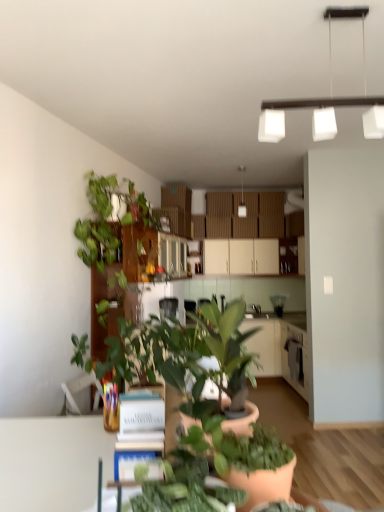
Locate an element on the screen. green leafy plant at left, placed as the third houseplant when sorted from front to back is located at coordinates (108, 218).

What do you see at coordinates (108, 218) in the screenshot? This screenshot has width=384, height=512. I see `green leafy plant at left, placed as the first houseplant when sorted from left to right` at bounding box center [108, 218].

At what (x,y) coordinates should I click in order to perform the action: click on green matte plant at center, arranged as the second houseplant when viewed from the back. Please return your answer as a coordinate pair (x, y). Image resolution: width=384 pixels, height=512 pixels. Looking at the image, I should click on (222, 361).

What is the approximate width of green matte plant at center, which ranks as the second houseplant in left-to-right order?

The width of green matte plant at center, which ranks as the second houseplant in left-to-right order, is 12.36 inches.

This screenshot has height=512, width=384. What do you see at coordinates (241, 257) in the screenshot?
I see `white matte cabinet at center` at bounding box center [241, 257].

Measure the distance between point (275, 490) and camera.

The depth of point (275, 490) is 32.52 inches.

Locate an element on the screen. green leafy plant at left, which ranks as the 1th houseplant in back-to-front order is located at coordinates (108, 218).

Considering the positions of objects green matte plant at center, positioned as the 3th houseplant in left-to-right order, and white matte cabinet at center in the image provided, who is more to the left, green matte plant at center, positioned as the 3th houseplant in left-to-right order, or white matte cabinet at center?

green matte plant at center, positioned as the 3th houseplant in left-to-right order, is more to the left.

Is white matte cabinet at center located within green matte plant at center, which is the 1th houseplant from right to left?

Actually, white matte cabinet at center is outside green matte plant at center, which is the 1th houseplant from right to left.

Measure the distance between green matte plant at center, which is the 1th houseplant from right to left, and white matte cabinet at center.

green matte plant at center, which is the 1th houseplant from right to left, and white matte cabinet at center are 4.70 meters apart from each other.

Which object is further away from the camera, green matte plant at center, which is counted as the 1th houseplant, starting from the front, or green matte plant at center, the second houseplant viewed from the right?

green matte plant at center, the second houseplant viewed from the right, is behind.

Could you measure the distance between green matte plant at center, which is the 1th houseplant from right to left, and green matte plant at center, which ranks as the second houseplant in left-to-right order?

green matte plant at center, which is the 1th houseplant from right to left, is 25.35 centimeters away from green matte plant at center, which ranks as the second houseplant in left-to-right order.

From the picture: Is green matte plant at center, the 3th houseplant when ordered from back to front, shorter than green matte plant at center, arranged as the second houseplant when viewed from the back?

Yes.

Are green matte plant at center, which is counted as the 1th houseplant, starting from the front, and green matte plant at center, the second houseplant viewed from the right, located far from each other?

No, there isn't a large distance between green matte plant at center, which is counted as the 1th houseplant, starting from the front, and green matte plant at center, the second houseplant viewed from the right.

Identify the location of cabinetry that appears behind the green matte plant at center, which is counted as the 1th houseplant, starting from the front. This screenshot has height=512, width=384. (241, 257).

From a real-world perspective, relative to green matte plant at center, positioned as the 3th houseplant in left-to-right order, is white matte cabinet at center vertically above or below?

white matte cabinet at center is above green matte plant at center, positioned as the 3th houseplant in left-to-right order.

Is white matte cabinet at center in front of green matte plant at center, which is the 1th houseplant from right to left?

No, it is not.

Is point (278, 243) closer or farther from the camera than point (259, 488)?

Point (278, 243) is positioned farther from the camera compared to point (259, 488).

What's the angular difference between green matte plant at center, arranged as the second houseplant when viewed from the back, and green leafy plant at left, which ranks as the 1th houseplant in back-to-front order,'s facing directions?

green matte plant at center, arranged as the second houseplant when viewed from the back, and green leafy plant at left, which ranks as the 1th houseplant in back-to-front order, are facing 14.8 degrees away from each other.

Looking at the image, does green matte plant at center, which ranks as the second houseplant in left-to-right order, seem bigger or smaller compared to green leafy plant at left, placed as the first houseplant when sorted from left to right?

green matte plant at center, which ranks as the second houseplant in left-to-right order, is smaller than green leafy plant at left, placed as the first houseplant when sorted from left to right.

From a real-world perspective, does green matte plant at center, arranged as the second houseplant when viewed from the back, stand above green leafy plant at left, which ranks as the 1th houseplant in back-to-front order?

No, from a real-world perspective, green matte plant at center, arranged as the second houseplant when viewed from the back, is not on top of green leafy plant at left, which ranks as the 1th houseplant in back-to-front order.

From the image's perspective, which one is positioned higher, green matte plant at center, the second houseplant viewed from the right, or green leafy plant at left, placed as the first houseplant when sorted from left to right?

green leafy plant at left, placed as the first houseplant when sorted from left to right.

Considering the relative sizes of green matte plant at center, which ranks as the second houseplant in left-to-right order, and white matte cabinet at center in the image provided, is green matte plant at center, which ranks as the second houseplant in left-to-right order, smaller than white matte cabinet at center?

Correct, green matte plant at center, which ranks as the second houseplant in left-to-right order, occupies less space than white matte cabinet at center.

Consider the image. From the image's perspective, between green matte plant at center, arranged as the second houseplant when viewed from the back, and white matte cabinet at center, who is located below?

From the image's view, green matte plant at center, arranged as the second houseplant when viewed from the back, is below.

From a real-world perspective, is green matte plant at center, the second houseplant viewed from the right, positioned under white matte cabinet at center based on gravity?

Indeed, from a real-world perspective, green matte plant at center, the second houseplant viewed from the right, is positioned beneath white matte cabinet at center.

Is the position of green matte plant at center, the second houseplant viewed from the right, less distant than that of white matte cabinet at center?

Yes, green matte plant at center, the second houseplant viewed from the right, is in front of white matte cabinet at center.

Is green matte plant at center, the 3th houseplant when ordered from back to front, not close to white matte book at center?

No, there isn't a large distance between green matte plant at center, the 3th houseplant when ordered from back to front, and white matte book at center.

Between green matte plant at center, positioned as the 3th houseplant in left-to-right order, and white matte book at center, which one has more height?

white matte book at center is taller.

Is green matte plant at center, the 3th houseplant when ordered from back to front, positioned with its back to white matte book at center?

green matte plant at center, the 3th houseplant when ordered from back to front, does not have its back to white matte book at center.

What's the angular difference between green leafy plant at left, which ranks as the 1th houseplant in back-to-front order, and green matte plant at center, the second houseplant viewed from the right,'s facing directions?

green leafy plant at left, which ranks as the 1th houseplant in back-to-front order, and green matte plant at center, the second houseplant viewed from the right, are facing 14.8 degrees away from each other.

Between point (91, 256) and point (199, 325), which one is positioned in front?

Positioned in front is point (199, 325).

Consider the image. Could you measure the distance between green leafy plant at left, placed as the first houseplant when sorted from left to right, and green matte plant at center, which is the 2th houseplant from front to back?

A distance of 1.88 meters exists between green leafy plant at left, placed as the first houseplant when sorted from left to right, and green matte plant at center, which is the 2th houseplant from front to back.

Are green leafy plant at left, which ranks as the 1th houseplant in back-to-front order, and green matte plant at center, arranged as the second houseplant when viewed from the back, located far from each other?

Absolutely, green leafy plant at left, which ranks as the 1th houseplant in back-to-front order, is distant from green matte plant at center, arranged as the second houseplant when viewed from the back.

The height and width of the screenshot is (512, 384). I want to click on cabinetry behind the green matte plant at center, positioned as the 3th houseplant in left-to-right order, so click(241, 257).

Image resolution: width=384 pixels, height=512 pixels. In order to click on houseplant below the green matte plant at center, the second houseplant viewed from the right (from a real-world perspective) in this screenshot , I will do `click(260, 466)`.

When comparing their distances from green leafy plant at left, which is the third houseplant from right to left, does green matte plant at center, which is the 1th houseplant from right to left, or white matte cabinet at center seem closer?

Among the two, white matte cabinet at center is located nearer to green leafy plant at left, which is the third houseplant from right to left.

Looking at this image, when comparing their distances from green matte plant at center, positioned as the 3th houseplant in left-to-right order, does green matte plant at center, which ranks as the second houseplant in left-to-right order, or white matte cabinet at center seem closer?

Among the two, green matte plant at center, which ranks as the second houseplant in left-to-right order, is located nearer to green matte plant at center, positioned as the 3th houseplant in left-to-right order.

Looking at the image, which one is located closer to white matte book at center, green matte plant at center, which ranks as the second houseplant in left-to-right order, or white matte cabinet at center?

green matte plant at center, which ranks as the second houseplant in left-to-right order, is closer to white matte book at center.

Which object lies further to the anchor point green leafy plant at left, which ranks as the 1th houseplant in back-to-front order, white matte cabinet at center or green matte plant at center, which is counted as the 1th houseplant, starting from the front?

Based on the image, green matte plant at center, which is counted as the 1th houseplant, starting from the front, appears to be further to green leafy plant at left, which ranks as the 1th houseplant in back-to-front order.

Estimate the real-world distances between objects in this image. Which object is closer to white matte cabinet at center, green leafy plant at left, placed as the third houseplant when sorted from front to back, or green matte plant at center, which ranks as the second houseplant in left-to-right order?

green leafy plant at left, placed as the third houseplant when sorted from front to back, is positioned closer to the anchor white matte cabinet at center.

Based on their spatial positions, is white matte cabinet at center or green matte plant at center, which is the 2th houseplant from front to back, further from green leafy plant at left, placed as the third houseplant when sorted from front to back?

white matte cabinet at center is further to green leafy plant at left, placed as the third houseplant when sorted from front to back.

Estimate the real-world distances between objects in this image. Which object is closer to white matte book at center, green matte plant at center, positioned as the 3th houseplant in left-to-right order, or green matte plant at center, which is the 2th houseplant from front to back?

The object closer to white matte book at center is green matte plant at center, which is the 2th houseplant from front to back.

Based on their spatial positions, is white matte book at center or green matte plant at center, the second houseplant viewed from the right, closer to green leafy plant at left, which ranks as the 1th houseplant in back-to-front order?

green matte plant at center, the second houseplant viewed from the right.

This screenshot has width=384, height=512. Identify the location of book between green matte plant at center, positioned as the 3th houseplant in left-to-right order, and green leafy plant at left, which is the third houseplant from right to left, along the z-axis. click(140, 434).

Where is `houseplant located between green matte plant at center, the second houseplant viewed from the right, and white matte cabinet at center in the depth direction`? The height and width of the screenshot is (512, 384). houseplant located between green matte plant at center, the second houseplant viewed from the right, and white matte cabinet at center in the depth direction is located at coordinates (108, 218).

Find the location of a particular element. houseplant located between white matte book at center and white matte cabinet at center in the depth direction is located at coordinates (108, 218).

Where is `houseplant positioned between green matte plant at center, positioned as the 3th houseplant in left-to-right order, and white matte book at center from near to far`? houseplant positioned between green matte plant at center, positioned as the 3th houseplant in left-to-right order, and white matte book at center from near to far is located at coordinates (222, 361).